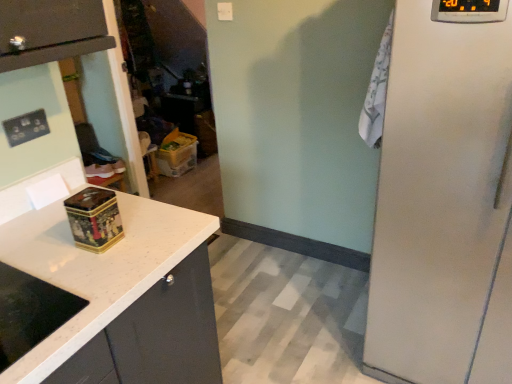
Question: Can you confirm if transparent plastic door at center is smaller than satin white refrigerator at right, which appears as the second appliance when viewed from the back?

Choices:
 (A) yes
 (B) no

Answer: (A)

Question: Considering the relative sizes of transparent plastic door at center and satin white refrigerator at right, the first appliance from the front, in the image provided, is transparent plastic door at center shorter than satin white refrigerator at right, the first appliance from the front,?

Choices:
 (A) no
 (B) yes

Answer: (B)

Question: Considering the relative positions of transparent plastic door at center and satin white refrigerator at right, marked as the second appliance in a bottom-to-top arrangement, in the image provided, is transparent plastic door at center to the right of satin white refrigerator at right, marked as the second appliance in a bottom-to-top arrangement, from the viewer's perspective?

Choices:
 (A) no
 (B) yes

Answer: (A)

Question: Is transparent plastic door at center not close to satin white refrigerator at right, which appears as the 2th appliance when viewed from the left?

Choices:
 (A) yes
 (B) no

Answer: (A)

Question: Is transparent plastic door at center oriented towards satin white refrigerator at right, which appears as the 2th appliance when viewed from the left?

Choices:
 (A) yes
 (B) no

Answer: (B)

Question: Is transparent plastic door at center not inside satin white refrigerator at right, which appears as the second appliance when viewed from the back?

Choices:
 (A) yes
 (B) no

Answer: (A)

Question: Considering the relative sizes of transparent plastic door at center and white granite countertop at left in the image provided, is transparent plastic door at center smaller than white granite countertop at left?

Choices:
 (A) yes
 (B) no

Answer: (A)

Question: From a real-world perspective, is transparent plastic door at center beneath white granite countertop at left?

Choices:
 (A) yes
 (B) no

Answer: (B)

Question: Is transparent plastic door at center facing towards white granite countertop at left?

Choices:
 (A) yes
 (B) no

Answer: (B)

Question: Does transparent plastic door at center appear on the left side of white granite countertop at left?

Choices:
 (A) yes
 (B) no

Answer: (A)

Question: Is transparent plastic door at center positioned beyond the bounds of white granite countertop at left?

Choices:
 (A) yes
 (B) no

Answer: (A)

Question: From a real-world perspective, is transparent plastic door at center on top of white granite countertop at left?

Choices:
 (A) no
 (B) yes

Answer: (B)

Question: Is satin white refrigerator at right, which appears as the 2th appliance when viewed from the left, inside gold metallic tin at center, the second appliance from the top?

Choices:
 (A) no
 (B) yes

Answer: (A)